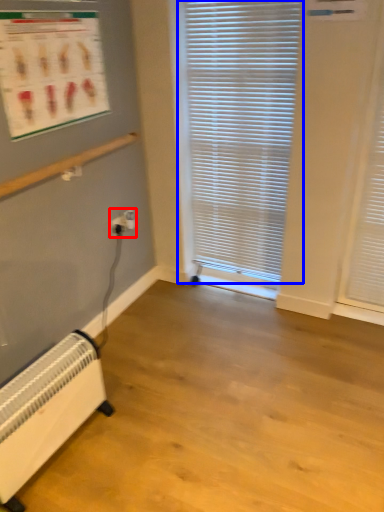
Question: Among these objects, which one is farthest to the camera, electric outlet (highlighted by a red box) or window blind (highlighted by a blue box)?

Choices:
 (A) electric outlet
 (B) window blind

Answer: (A)